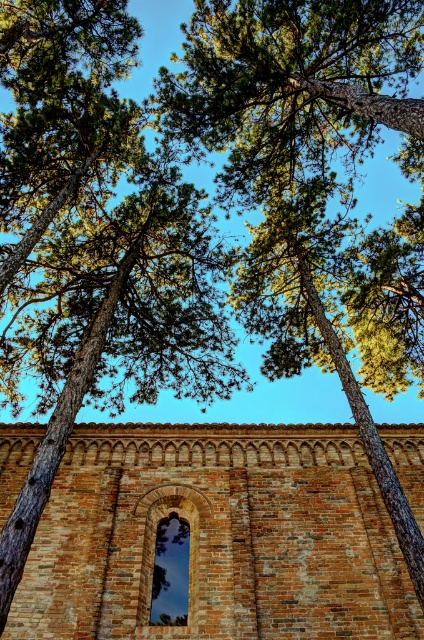
Which of these two, brown brick church at center or dark glass window at center, stands shorter?

Standing shorter between the two is dark glass window at center.

Can you confirm if brown brick church at center is positioned below dark glass window at center?

No, brown brick church at center is not below dark glass window at center.

Describe the element at coordinates (217, 536) in the screenshot. I see `brown brick church at center` at that location.

Identify the location of brown brick church at center. This screenshot has width=424, height=640. (217, 536).